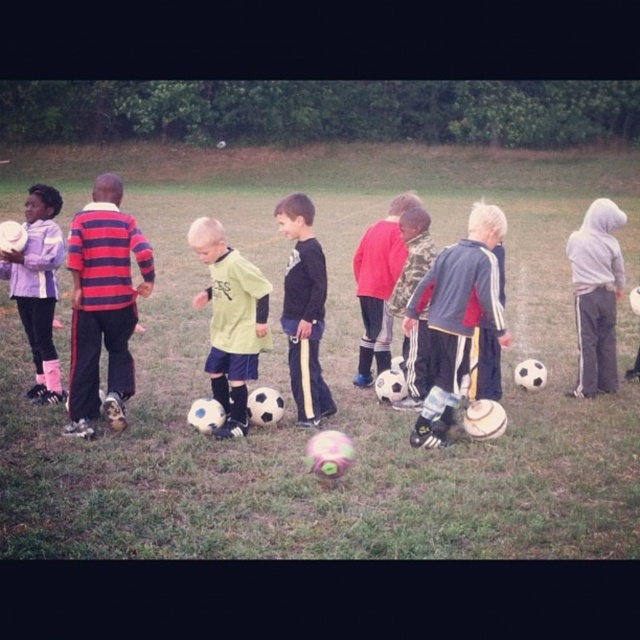
You are a soccer coach standing at the edge of the field. You notice the white matte soccer ball at center and the blue and white striped shirt at center. If you want to pick up the soccer ball first, which object should you approach first?

The white matte soccer ball at center is 23.25 meters away from the blue and white striped shirt at center. Since you want to pick up the soccer ball first, you should approach the white matte soccer ball at center first because it is farther away than the blue and white striped shirt at center. Wait, actually, if the ball is 23.25 meters away from the shirt, then the shirt is closer to the coach. Hmm, maybe I need to clarify the positions. The coach is at the edge, and both the ball and shirt are at center

You are a coach observing the children on the field. You need to give a ball to the striped jersey at left and the blue and white striped shirt at center. Which player should you approach first if you are standing in front of the line of children?

The striped jersey at left should be approached first because they are in front of the blue and white striped shirt at center, making them closer to the coach.